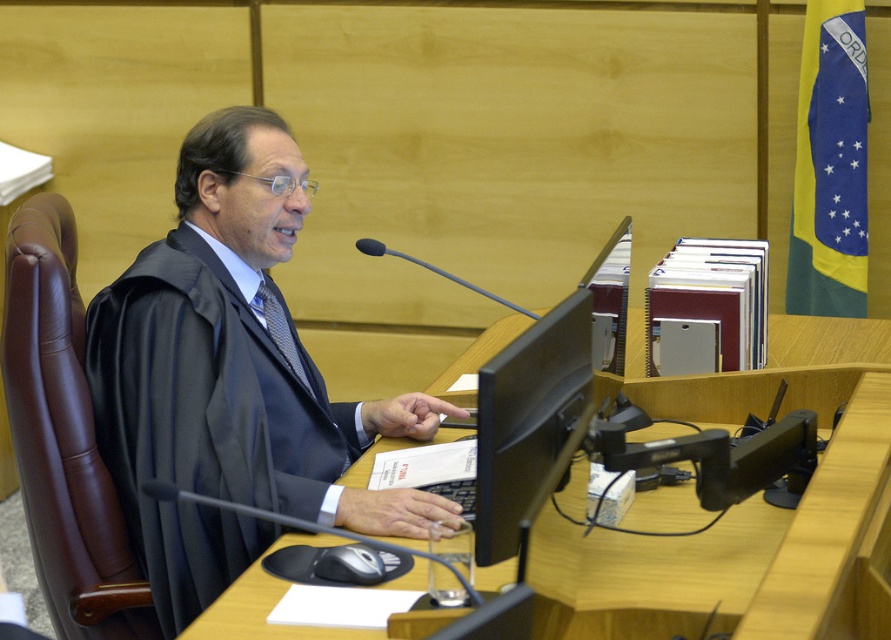
You are a tailor measuring the distance between the black matte robe at center and the black textured tie at center for a custom suit. Can you fit a standard 8.5 inch ruler between them?

The black matte robe at center and black textured tie at center are 9.09 inches apart, so yes, a standard 8.5 inch ruler can fit between them since the distance is slightly larger than the ruler.

You are an assistant in the courtroom. You need to place a new document organizer between the black matte robe at center and the wooden desk at center. Based on their positions, which object should the organizer be closer to?

The organizer should be placed closer to the wooden desk at center because the black matte robe at center is to the left of the wooden desk at center, meaning there is space between them where the organizer can be positioned near the desk.